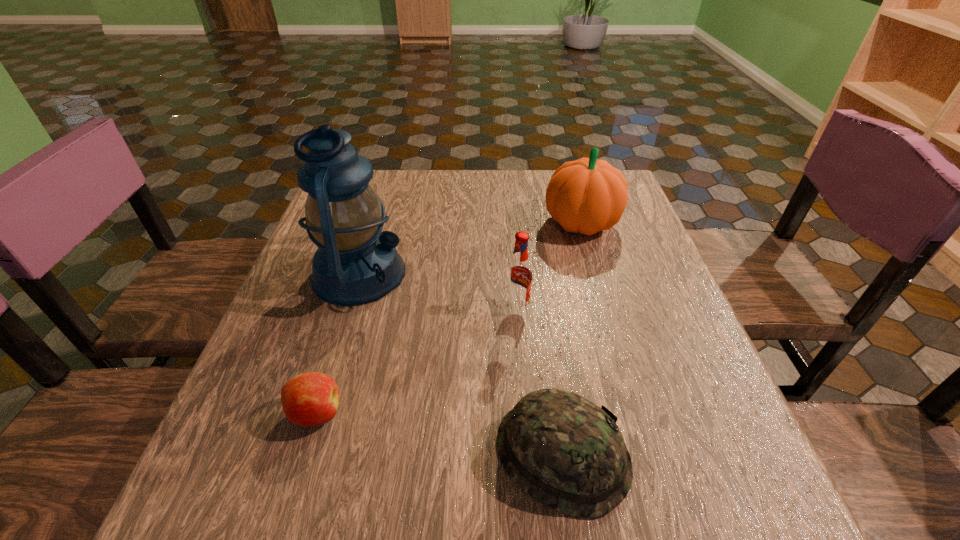
I want to click on vacant region between the pumpkin and the shortest object, so click(448, 318).

Identify which object is located as the fourth nearest to the root beer. Please provide its 2D coordinates. Your answer should be formatted as a tuple, i.e. [(x, y)], where the tuple contains the x and y coordinates of a point satisfying the conditions above.

[(310, 399)]

At what (x,y) coordinates should I click in order to perform the action: click on object that is the second nearest to the tallest object. Please return your answer as a coordinate pair (x, y). The width and height of the screenshot is (960, 540). Looking at the image, I should click on (518, 283).

Find the location of a particular element. Image resolution: width=960 pixels, height=540 pixels. vacant space that satisfies the following two spatial constraints: 1. on the face of the lantern; 2. on the right side of the root beer is located at coordinates (348, 308).

Locate an element on the screen. This screenshot has height=540, width=960. vacant position in the image that satisfies the following two spatial constraints: 1. on the face of the tallest object; 2. on the back side of the root beer is located at coordinates (348, 308).

Find the location of `free spot that satisfies the following two spatial constraints: 1. on the front side of the root beer; 2. on the left side of the headwear`. free spot that satisfies the following two spatial constraints: 1. on the front side of the root beer; 2. on the left side of the headwear is located at coordinates (529, 455).

This screenshot has height=540, width=960. Find the location of `vacant region that satisfies the following two spatial constraints: 1. on the face of the second shortest object; 2. on the right side of the lantern`. vacant region that satisfies the following two spatial constraints: 1. on the face of the second shortest object; 2. on the right side of the lantern is located at coordinates 303,455.

This screenshot has height=540, width=960. What are the coordinates of `blank space that satisfies the following two spatial constraints: 1. on the front side of the second shortest object; 2. on the left side of the apple` in the screenshot? It's located at (303, 455).